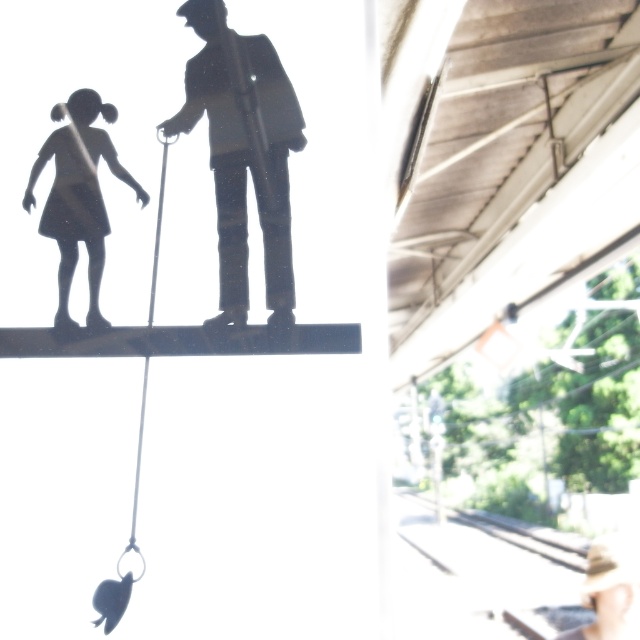
Is silhouette figure at center positioned before matte black figure at left?

Yes, silhouette figure at center is in front of matte black figure at left.

Who is taller, silhouette figure at center or matte black figure at left?

Standing taller between the two is silhouette figure at center.

Find the location of a particular element. This screenshot has width=640, height=640. silhouette figure at center is located at coordinates (243, 154).